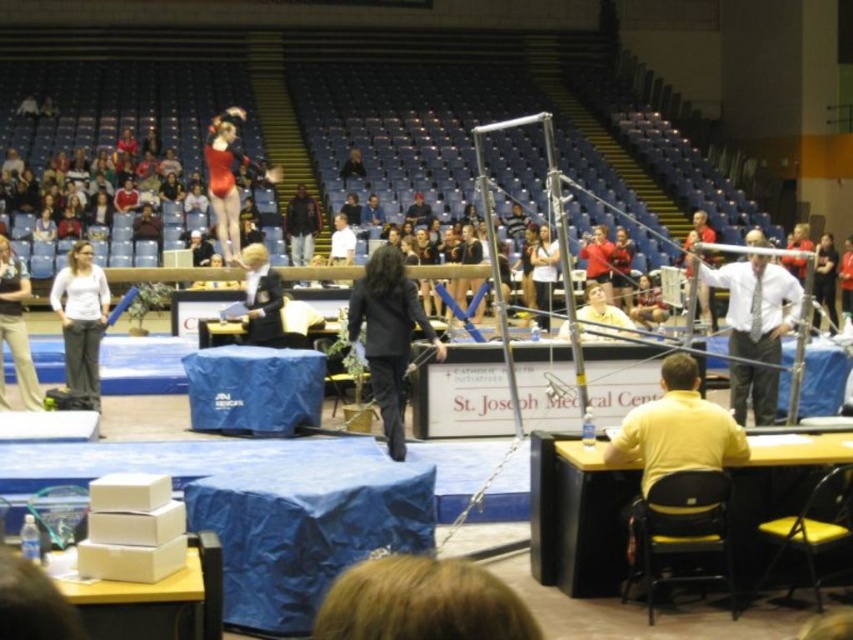
Between point (737, 376) and point (550, 278), which one is positioned behind?

Positioned behind is point (550, 278).

Identify the location of white shirt at center. [x=756, y=305].

Where is `white shirt at center`? The height and width of the screenshot is (640, 853). white shirt at center is located at coordinates (756, 305).

Can you confirm if yellow smooth shirt at lower right is shorter than light brown hair at upper center?

Yes.

Who is more distant from viewer, (694, 420) or (552, 262)?

Point (552, 262)

The height and width of the screenshot is (640, 853). What do you see at coordinates (676, 428) in the screenshot?
I see `yellow smooth shirt at lower right` at bounding box center [676, 428].

Locate an element on the screen. yellow smooth shirt at lower right is located at coordinates (676, 428).

Which of these two, black fabric jacket at center or white soft pants at left, stands shorter?

white soft pants at left is shorter.

Can you confirm if black fabric jacket at center is positioned to the left of white soft pants at left?

Incorrect, black fabric jacket at center is not on the left side of white soft pants at left.

The width and height of the screenshot is (853, 640). Describe the element at coordinates (387, 336) in the screenshot. I see `black fabric jacket at center` at that location.

Identify the location of black fabric jacket at center. The height and width of the screenshot is (640, 853). (387, 336).